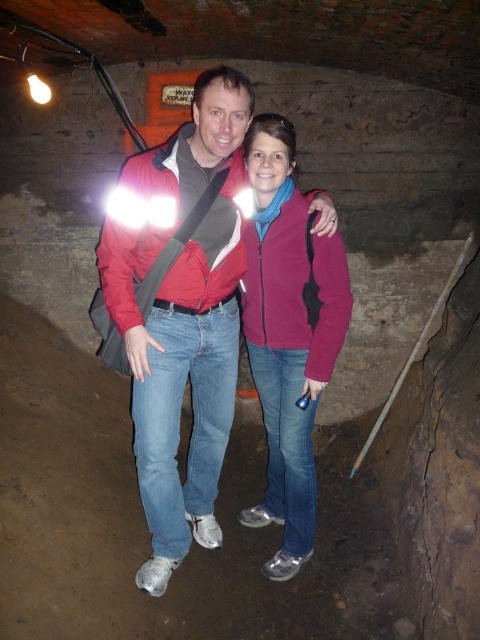
You are exploring a dark underground cave with a flashlight. You see two people wearing jackets. One is wearing a matte red jacket at center and the other a matte pink jacket at center. According to the scene description, which jacket is positioned to the left of the other?

The matte red jacket at center is to the left of the matte pink jacket at center.